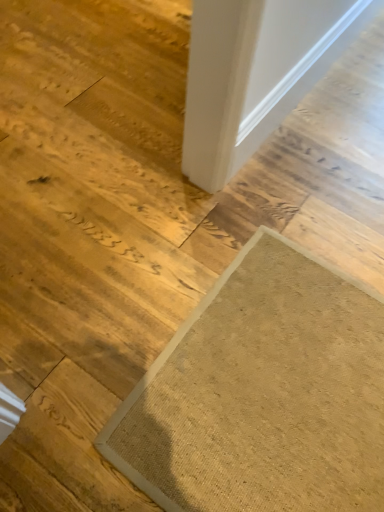
Question: Would you say white smooth door at upper right is inside or outside textured beige mat at lower right?

Choices:
 (A) inside
 (B) outside

Answer: (B)

Question: Considering the relative positions of white smooth door at upper right and textured beige mat at lower right in the image provided, is white smooth door at upper right to the left or to the right of textured beige mat at lower right?

Choices:
 (A) left
 (B) right

Answer: (B)

Question: From the image's perspective, relative to textured beige mat at lower right, is white smooth door at upper right above or below?

Choices:
 (A) above
 (B) below

Answer: (A)

Question: From a real-world perspective, relative to white smooth door at upper right, is textured beige mat at lower right vertically above or below?

Choices:
 (A) below
 (B) above

Answer: (A)

Question: Is textured beige mat at lower right inside the boundaries of white smooth door at upper right, or outside?

Choices:
 (A) outside
 (B) inside

Answer: (A)

Question: Based on their sizes in the image, would you say textured beige mat at lower right is bigger or smaller than white smooth door at upper right?

Choices:
 (A) big
 (B) small

Answer: (A)

Question: Considering the relative positions of textured beige mat at lower right and white smooth door at upper right in the image provided, is textured beige mat at lower right to the left or to the right of white smooth door at upper right?

Choices:
 (A) right
 (B) left

Answer: (B)